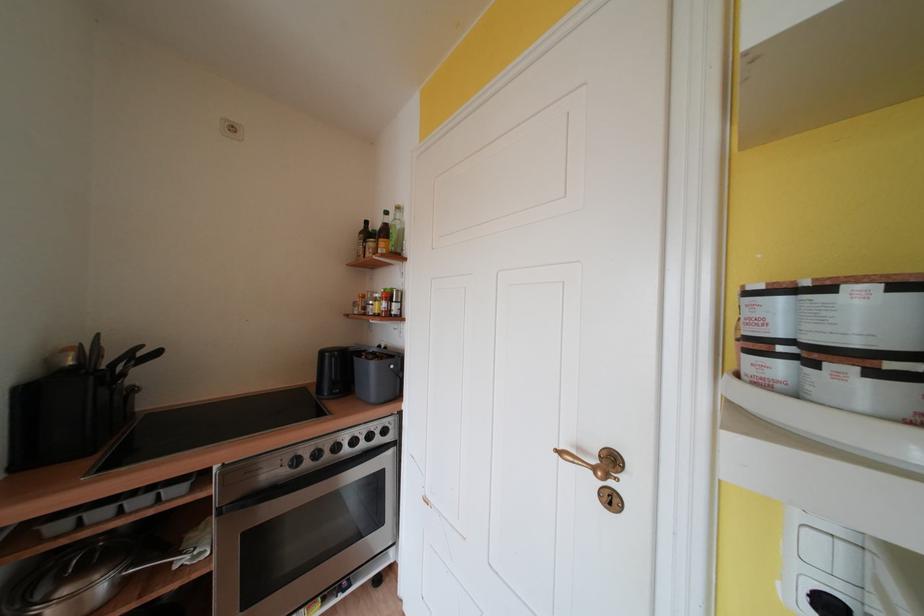
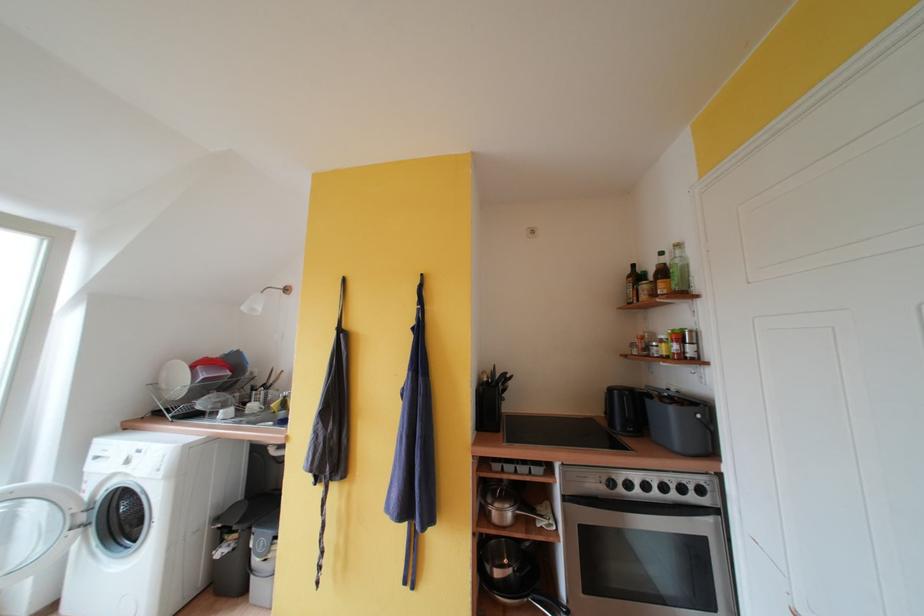
Find the pixel in the second image that matches [367,236] in the first image.

(634, 281)